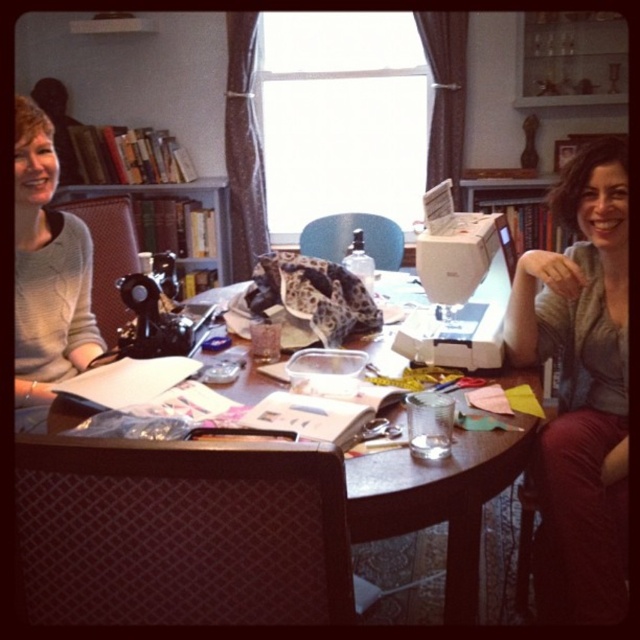
Does matte gray sweater at right appear over wooden table at center?

Yes.

Is point (563, 385) closer to camera compared to point (500, 541)?

Yes.

Identify the location of matte gray sweater at right. (580, 388).

Is matte gray sweater at right thinner than light gray sweater at left?

Incorrect, matte gray sweater at right's width is not less than light gray sweater at left's.

What do you see at coordinates (580, 388) in the screenshot?
I see `matte gray sweater at right` at bounding box center [580, 388].

The width and height of the screenshot is (640, 640). I want to click on matte gray sweater at right, so click(x=580, y=388).

Is light gray sweater at left positioned before wooden bookshelf at upper left?

Yes, it is in front of wooden bookshelf at upper left.

Who is more distant from viewer, (93, 352) or (221, 202)?

Positioned behind is point (221, 202).

Locate an element on the screen. The height and width of the screenshot is (640, 640). light gray sweater at left is located at coordinates click(x=48, y=268).